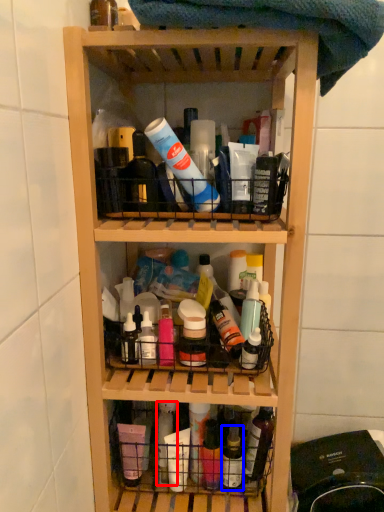
Question: Which object is further to the camera taking this photo, bottle (highlighted by a red box) or bottle (highlighted by a blue box)?

Choices:
 (A) bottle
 (B) bottle

Answer: (B)